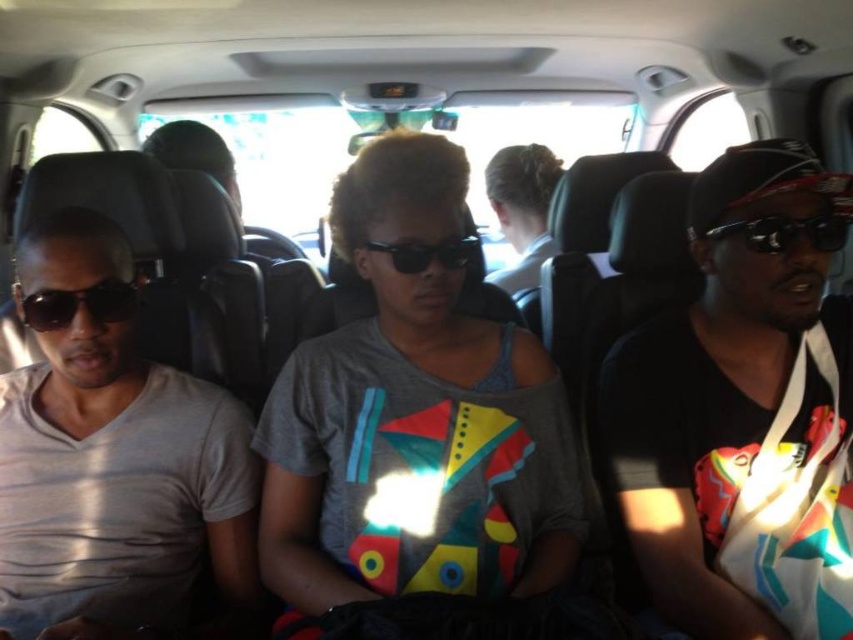
You are a passenger in the vehicle and need to reach a point in the vehicle. The point you need to reach is located at point (x=47, y=326). There is an obstacle at point (x=439, y=256). Can you safely walk to your destination without going around the obstacle?

Point (x=47, y=326) is behind point (x=439, y=256), so you can safely walk to your destination without needing to go around the obstacle because the obstacle is in front of your destination and you can pass behind it.

You are a passenger seated in the vehicle and want to borrow sunglasses from the two people sitting in front of you. The two pairs are matte black sunglasses at left and black plastic sunglasses at center. Which pair is closer to your left side?

The matte black sunglasses at left are to the left of the black plastic sunglasses at center, so the matte black sunglasses at left are closer to your left side.

You are a passenger in the van and want to place a small item on the seat in front of you. There is a black plastic sunglasses at right. Where should you place the item to avoid blocking the sunglasses?

Place the item away from the coordinates point (785, 230) where the black plastic sunglasses at right is located.